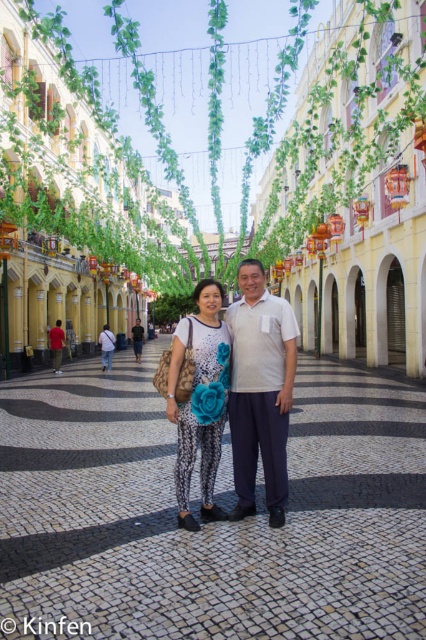
Question: Among these points, which one is nearest to the camera?

Choices:
 (A) (137, 326)
 (B) (51, 352)
 (C) (226, 342)

Answer: (C)

Question: Is white cotton shirt at center thinner than matte white shirt at center?

Choices:
 (A) yes
 (B) no

Answer: (A)

Question: Which point is closer to the camera?

Choices:
 (A) printed fabric leggings at center
 (B) matte white shirt at center
 (C) white cotton shirt at center

Answer: (C)

Question: Considering the real-world distances, which object is closest to the white cotton shirt at center?

Choices:
 (A) printed fabric leggings at center
 (B) red cotton shirt at center

Answer: (A)

Question: Does red cotton shirt at center come behind matte white shirt at center?

Choices:
 (A) yes
 (B) no

Answer: (B)

Question: Does white cotton shirt at center have a smaller size compared to matte white shirt at center?

Choices:
 (A) yes
 (B) no

Answer: (A)